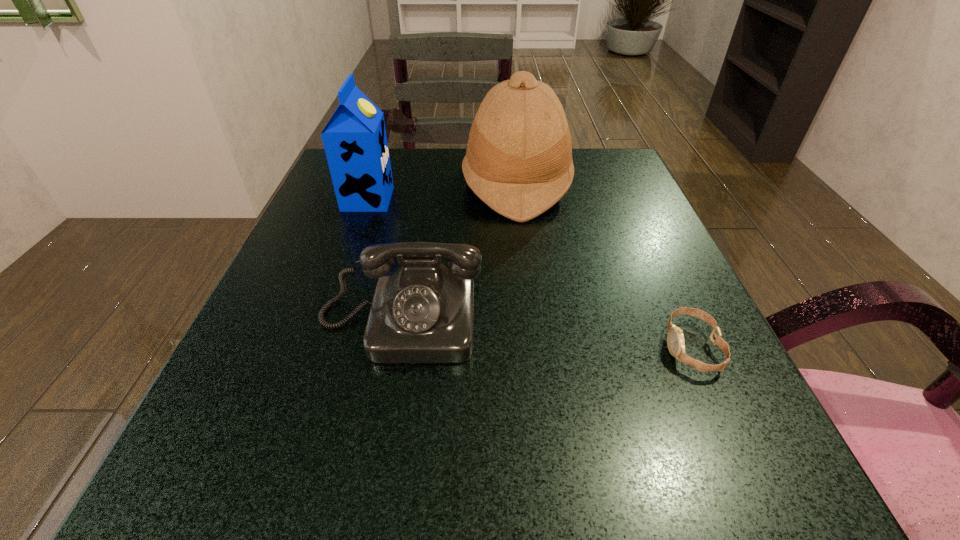
Where is `empty location between the carton and the watch`? The image size is (960, 540). empty location between the carton and the watch is located at coordinates (530, 273).

This screenshot has width=960, height=540. I want to click on the second closest object to the shortest object, so click(x=423, y=312).

You are a GUI agent. You are given a task and a screenshot of the screen. Output one action in this format:
    pyautogui.click(x=<x>, y=<y>)
    Task: Click on the third closest object to the carton
    The width and height of the screenshot is (960, 540).
    Given the screenshot: What is the action you would take?
    pyautogui.click(x=675, y=339)

The image size is (960, 540). Identify the location of free region that satisfies the following two spatial constraints: 1. on the front-facing side of the hat; 2. on the dial of the telephone. (533, 322).

Find the location of a particular element. free space that satisfies the following two spatial constraints: 1. on the front-facing side of the hat; 2. on the dial of the telephone is located at coordinates (533, 322).

Find the location of a particular element. The width and height of the screenshot is (960, 540). free space that satisfies the following two spatial constraints: 1. on the front-facing side of the hat; 2. on the dial of the telephone is located at coordinates (533, 322).

I want to click on vacant space that satisfies the following two spatial constraints: 1. on the front-facing side of the hat; 2. on the dial of the third tallest object, so click(x=533, y=322).